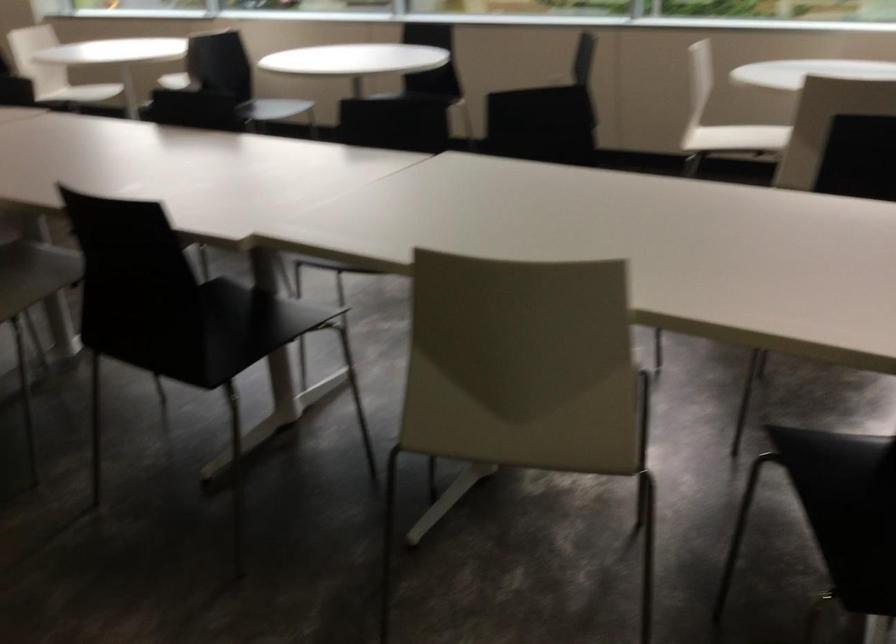
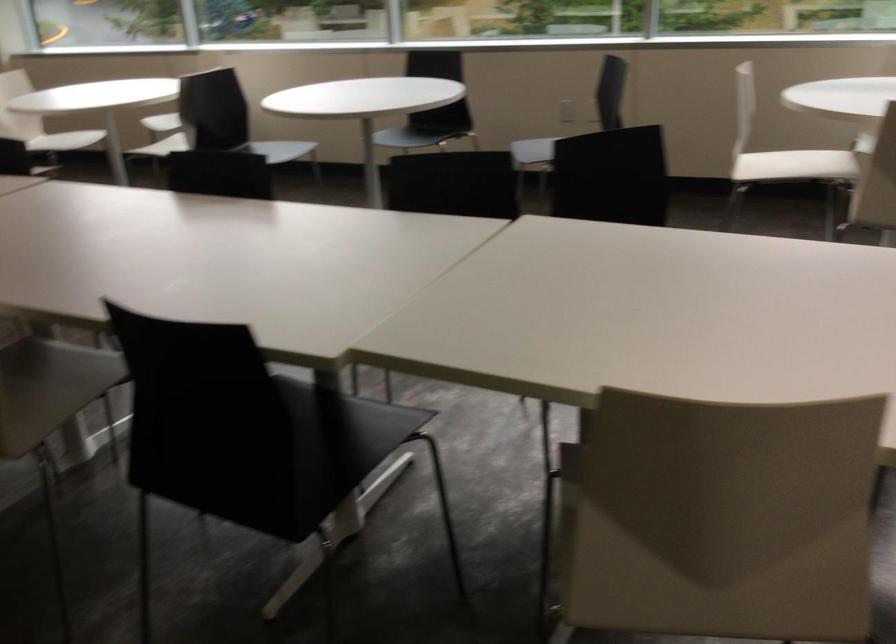
The images are taken continuously from a first-person perspective. In which direction are you moving?

The movement direction of the cameraman is left, forward.